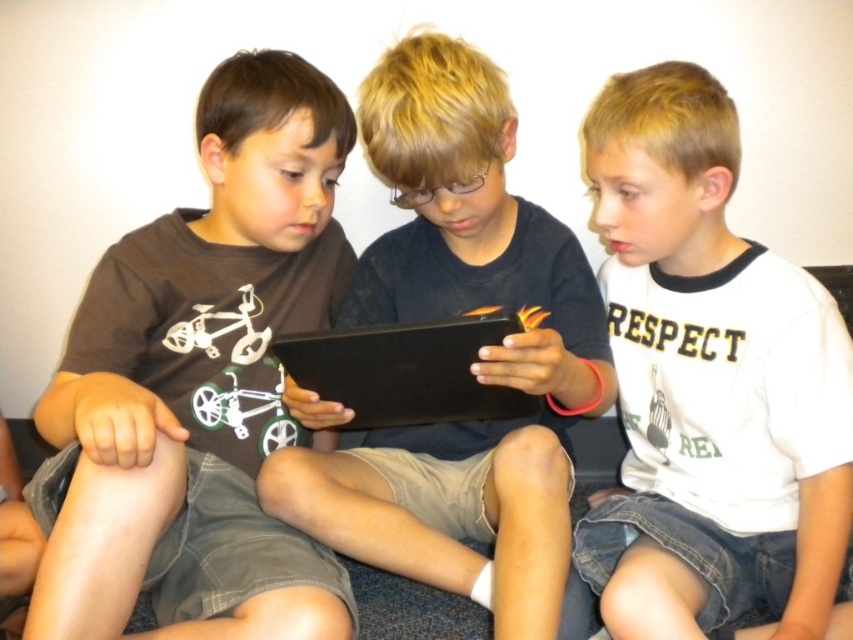
Question: Which is farther from the black matte tablet at center?

Choices:
 (A) matte black shirt at left
 (B) white cotton shirt at center
 (C) black matte laptop at center

Answer: (B)

Question: Can you confirm if black matte tablet at center is positioned to the left of black matte laptop at center?

Choices:
 (A) no
 (B) yes

Answer: (A)

Question: Does matte black shirt at left appear under white cotton shirt at center?

Choices:
 (A) no
 (B) yes

Answer: (A)

Question: Among these objects, which one is farthest from the camera?

Choices:
 (A) black matte tablet at center
 (B) matte black shirt at left

Answer: (A)

Question: Which is nearer to the white cotton shirt at center?

Choices:
 (A) black matte tablet at center
 (B) black matte laptop at center

Answer: (A)

Question: Considering the relative positions of matte black shirt at left and white cotton shirt at center in the image provided, where is matte black shirt at left located with respect to white cotton shirt at center?

Choices:
 (A) below
 (B) above

Answer: (B)